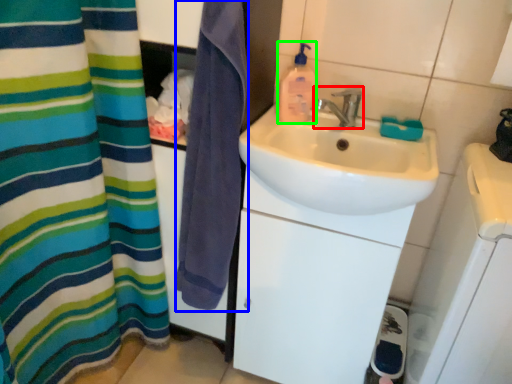
Question: Considering the real-world distances, which object is closest to tap (highlighted by a red box)? beach towel (highlighted by a blue box) or cleaning product (highlighted by a green box).

Choices:
 (A) beach towel
 (B) cleaning product

Answer: (B)